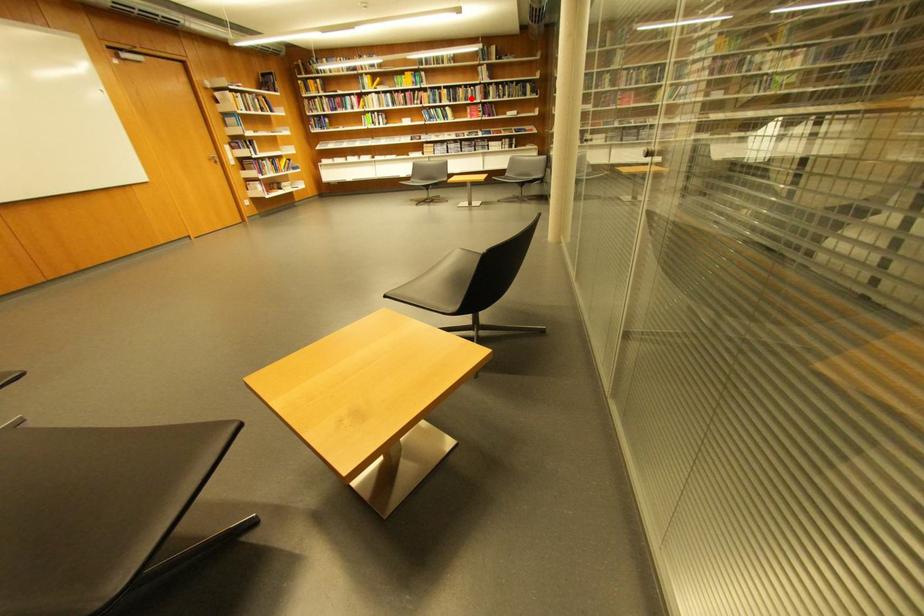
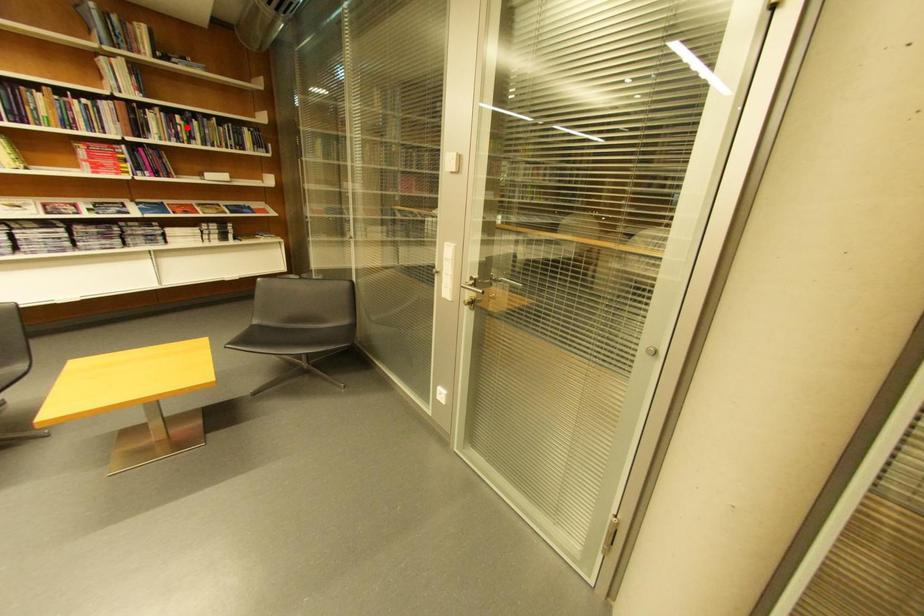
I am providing you with two images of the same scene from different viewpoints. A red point is marked on the first image and another point is marked on the second image. Do the highlighted points in image1 and image2 indicate the same real-world spot?

No